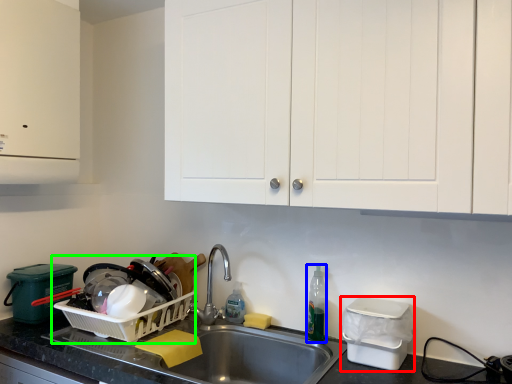
Question: Based on their relative distances, which object is nearer to appliance (highlighted by a red box)? Choose from bottle (highlighted by a blue box) and appliance (highlighted by a green box).

Choices:
 (A) bottle
 (B) appliance

Answer: (A)